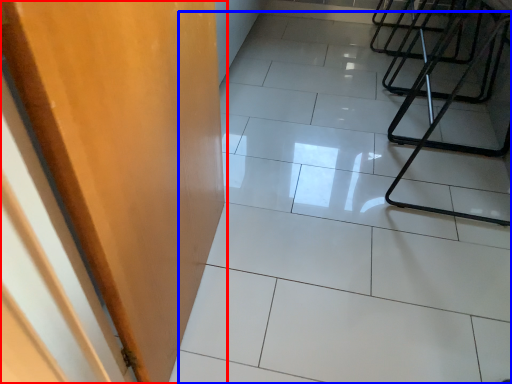
Question: Among these objects, which one is nearest to the camera, door (highlighted by a red box) or ceramic tile (highlighted by a blue box)?

Choices:
 (A) door
 (B) ceramic tile

Answer: (A)